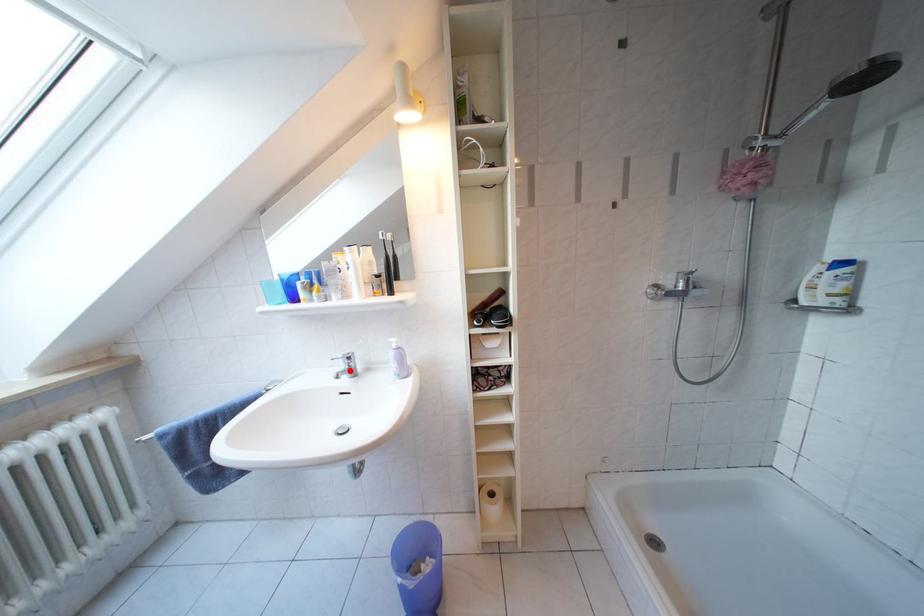
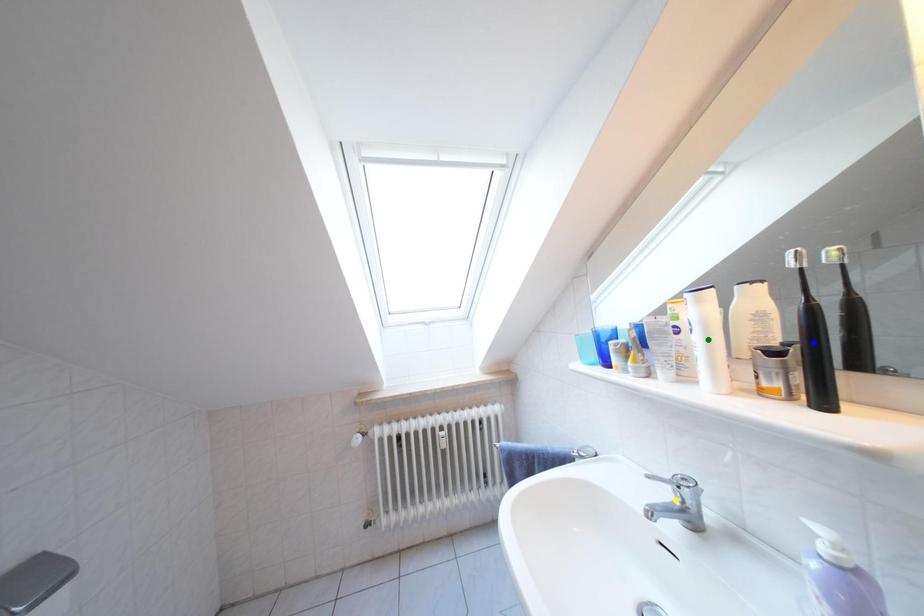
Question: I am providing you with two images of the same scene from different viewpoints. A red point is marked on the first image. You are given multiple points on the second image. Which mark in image 2 goes with the point in image 1?

Choices:
 (A) yellow point
 (B) blue point
 (C) green point

Answer: (A)